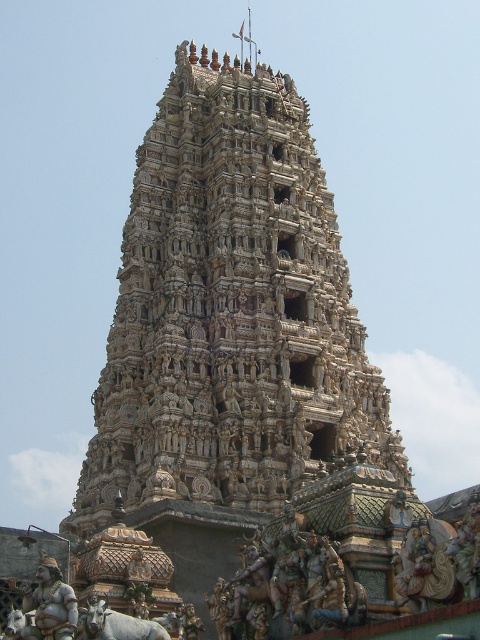
What is located at the point with coordinates (425, 564) in the temple?

The point with coordinates (425, 564) corresponds to a golden carved statue at center.

You are standing in front of the temple and want to locate the golden carved statue at center. According to the coordinates provided, where should you look to find it?

The golden carved statue at center is located at point coordinates (425, 564), so you should look towards the lower right area of the temple structure to find it.

You are an architect examining the temple structure. You notice the carved stone temple at center and the multicolored carved figures at lower center. Which of these two elements is positioned higher in the image?

The carved stone temple at center is positioned higher than the multicolored carved figures at lower center.